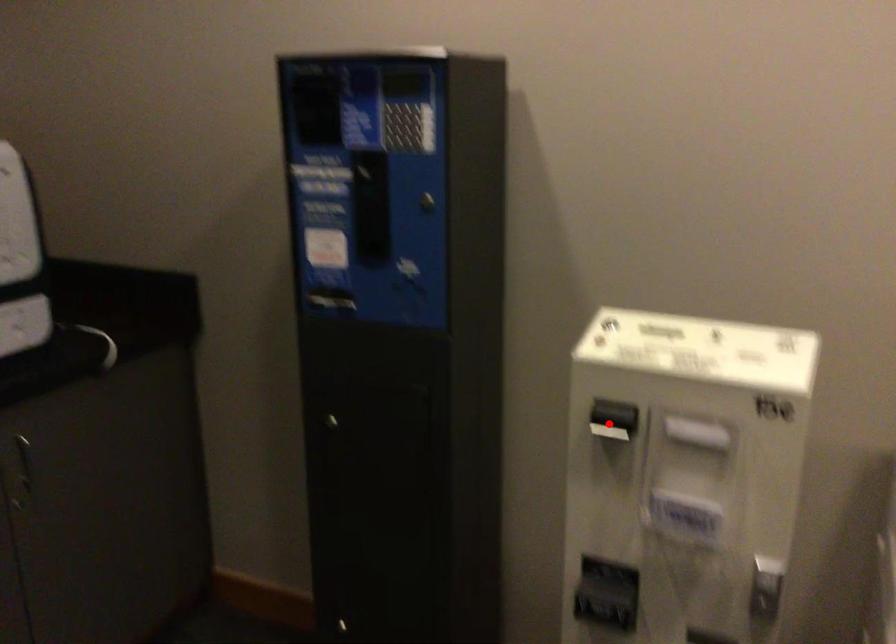
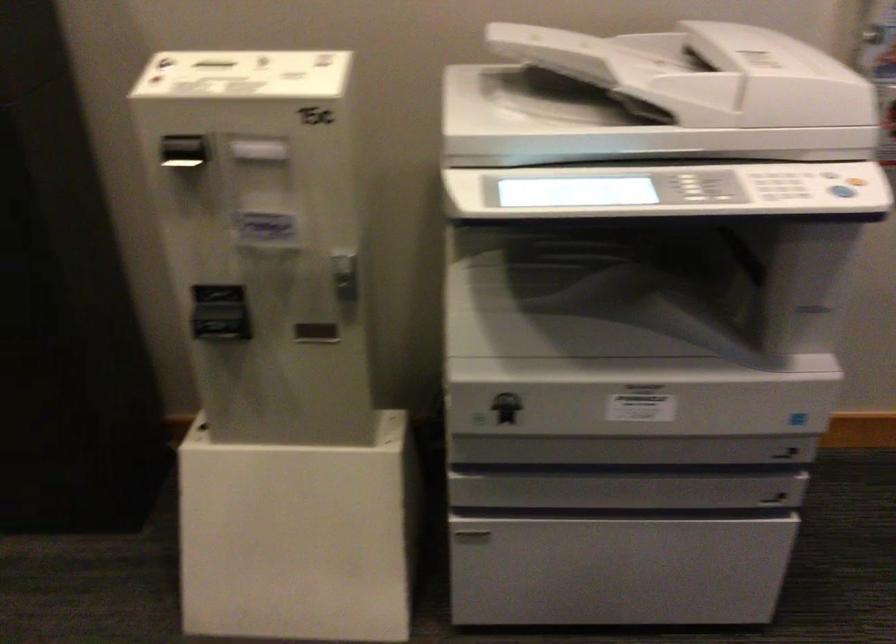
Find the pixel in the second image that matches the highlighted location in the first image.

(185, 156)